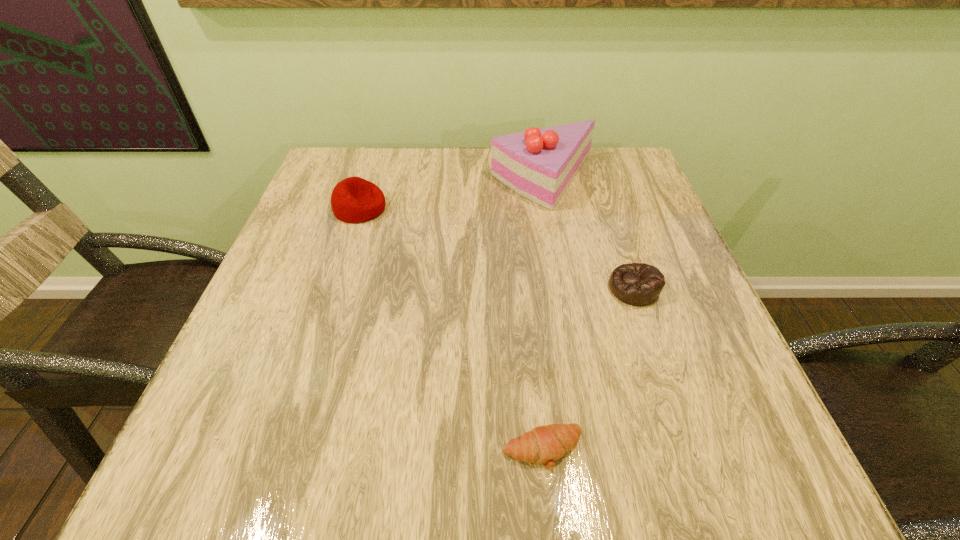
This screenshot has height=540, width=960. Identify the location of empty space that is in between the cake and the crescent roll. (543, 315).

You are a GUI agent. You are given a task and a screenshot of the screen. Output one action in this format:
    pyautogui.click(x=<x>, y=<y>)
    Task: Click on the free space between the shorter beanbag and the cake
    Image resolution: width=960 pixels, height=540 pixels.
    Given the screenshot: What is the action you would take?
    pyautogui.click(x=588, y=234)

Locate an element on the screen. vacant point located between the cake and the shorter beanbag is located at coordinates (588, 234).

You are a GUI agent. You are given a task and a screenshot of the screen. Output one action in this format:
    pyautogui.click(x=<x>, y=<y>)
    Task: Click on the vacant space that's between the leftmost object and the second nearest object
    This screenshot has height=540, width=960.
    Given the screenshot: What is the action you would take?
    pyautogui.click(x=496, y=248)

Locate an element on the screen. Image resolution: width=960 pixels, height=540 pixels. vacant space that is in between the right beanbag and the cake is located at coordinates pos(588,234).

Locate which object is the closest to the leftmost object. Please provide its 2D coordinates. Your answer should be formatted as a tuple, i.e. [(x, y)], where the tuple contains the x and y coordinates of a point satisfying the conditions above.

[(539, 164)]

The width and height of the screenshot is (960, 540). What are the coordinates of `object that can be found as the third closest to the right beanbag` in the screenshot? It's located at (353, 200).

Find the location of `vacant region that satisfies the following two spatial constraints: 1. on the seat area of the crescent roll; 2. on the right side of the third shortest object`. vacant region that satisfies the following two spatial constraints: 1. on the seat area of the crescent roll; 2. on the right side of the third shortest object is located at coordinates (282, 450).

At what (x,y) coordinates should I click in order to perform the action: click on vacant space that satisfies the following two spatial constraints: 1. on the seat area of the taller beanbag; 2. on the left side of the nearest object. Please return your answer as a coordinate pair (x, y). This screenshot has width=960, height=540. Looking at the image, I should click on (282, 450).

Where is `vacant region that satisfies the following two spatial constraints: 1. on the seat area of the taller beanbag; 2. on the back side of the third farthest object`? The width and height of the screenshot is (960, 540). vacant region that satisfies the following two spatial constraints: 1. on the seat area of the taller beanbag; 2. on the back side of the third farthest object is located at coordinates (334, 288).